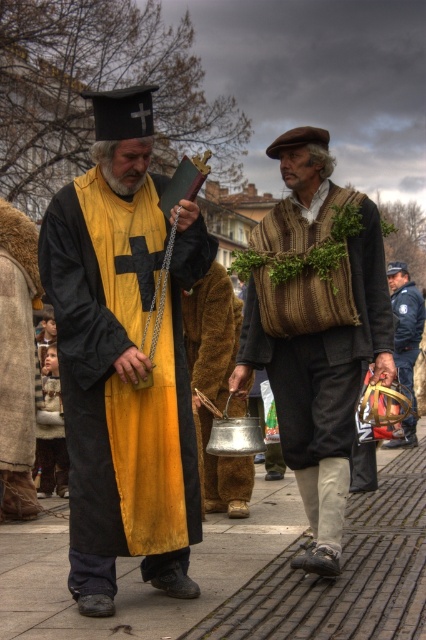
Question: Based on their relative distances, which object is farther from the metallic gold helmet at center?

Choices:
 (A) brick pavement at lower center
 (B) matte yellow robe at center
 (C) brown woven basket at center

Answer: (B)

Question: From the image, what is the correct spatial relationship of matte yellow robe at center in relation to metallic silver pot at center?

Choices:
 (A) right
 (B) left

Answer: (B)

Question: Which point is closer to the camera?

Choices:
 (A) metallic gold helmet at center
 (B) brown woven basket at center
 (C) matte yellow robe at center
 (D) metallic silver pot at center

Answer: (C)

Question: Where is brick pavement at lower center located in relation to metallic silver pot at center in the image?

Choices:
 (A) above
 (B) below

Answer: (B)

Question: Which is farther from the brown woven basket at center?

Choices:
 (A) brick pavement at lower center
 (B) metallic gold helmet at center
 (C) metallic silver pot at center
 (D) matte yellow robe at center

Answer: (B)

Question: Can you confirm if matte yellow robe at center is positioned to the right of brick pavement at lower center?

Choices:
 (A) yes
 (B) no

Answer: (B)